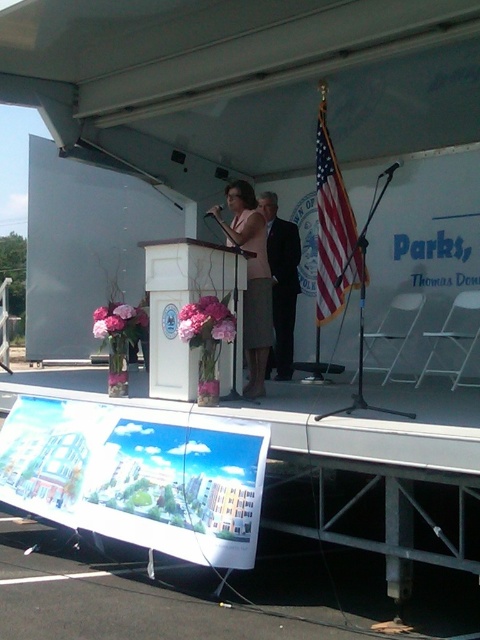
Question: Which point appears farthest from the camera in this image?

Choices:
 (A) (248, 224)
 (B) (336, 250)

Answer: (B)

Question: Can you confirm if american flag at center is positioned to the right of black suit at center?

Choices:
 (A) no
 (B) yes

Answer: (B)

Question: Does american flag at center appear over black suit at center?

Choices:
 (A) yes
 (B) no

Answer: (A)

Question: Is american flag at center behind matte pink dress at center?

Choices:
 (A) yes
 (B) no

Answer: (A)

Question: Which object is positioned farthest from the american flag at center?

Choices:
 (A) matte pink dress at center
 (B) black suit at center

Answer: (A)

Question: Among these objects, which one is farthest from the camera?

Choices:
 (A) american flag at center
 (B) black suit at center

Answer: (B)